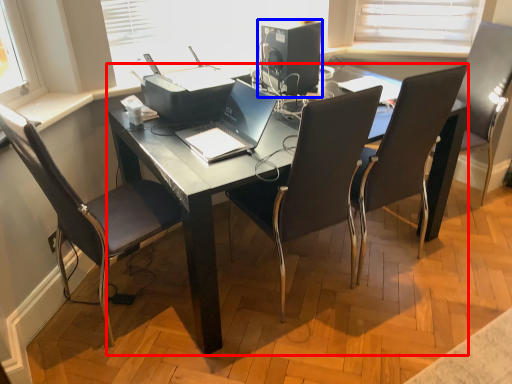
Question: Which object is further to the camera taking this photo, desk (highlighted by a red box) or desktop computer (highlighted by a blue box)?

Choices:
 (A) desk
 (B) desktop computer

Answer: (B)